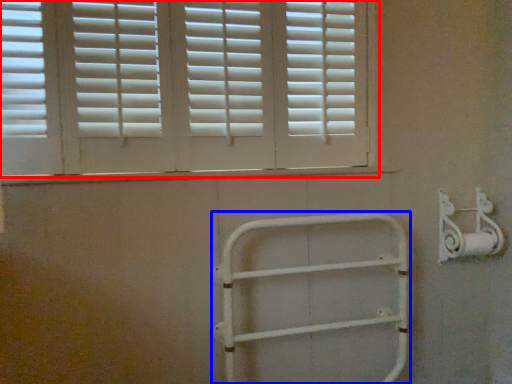
Question: Which of the following is the closest to the observer, window (highlighted by a red box) or rail (highlighted by a blue box)?

Choices:
 (A) window
 (B) rail

Answer: (A)